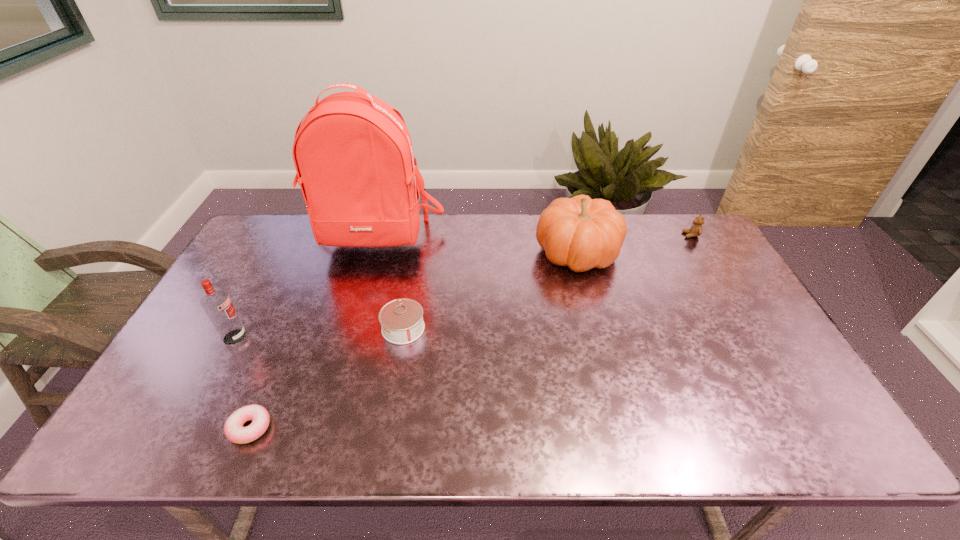
Locate an element on the screen. Image resolution: width=960 pixels, height=540 pixels. backpack is located at coordinates (353, 154).

The width and height of the screenshot is (960, 540). What are the coordinates of `the fifth object from left to right` in the screenshot? It's located at (582, 233).

The image size is (960, 540). In order to click on vodka in this screenshot , I will do `click(217, 304)`.

Where is `teddy bear`? This screenshot has width=960, height=540. teddy bear is located at coordinates (696, 229).

Identify the location of the rightmost object. (696, 229).

Where is `the second shortest object`? The height and width of the screenshot is (540, 960). the second shortest object is located at coordinates (402, 323).

Where is `the shortest object`? Image resolution: width=960 pixels, height=540 pixels. the shortest object is located at coordinates (233, 428).

This screenshot has width=960, height=540. What are the coordinates of `the nearest object` in the screenshot? It's located at (233, 428).

This screenshot has height=540, width=960. Identify the location of free space located on the main compartment of the tallest object. (353, 315).

Identify the location of vacant space located on the left of the pumpkin. (423, 252).